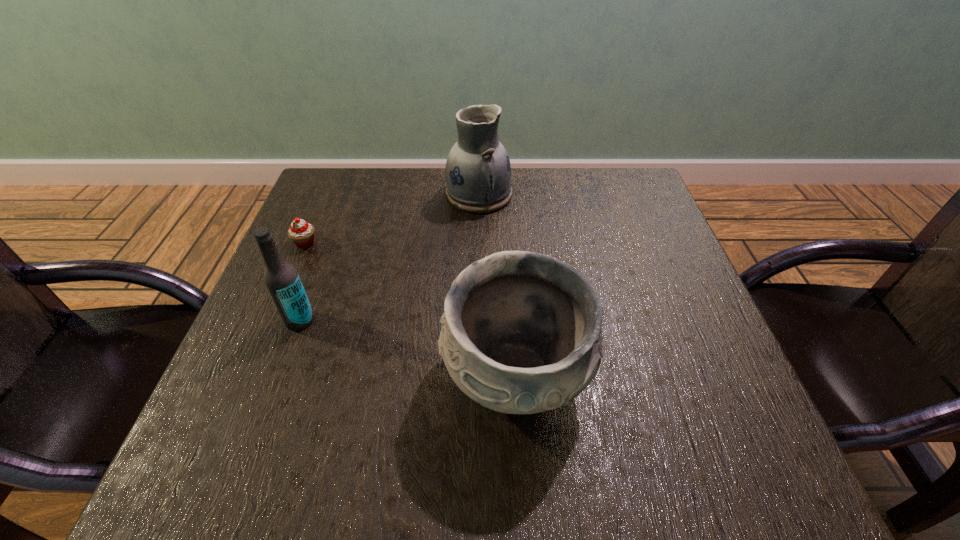
You are a GUI agent. You are given a task and a screenshot of the screen. Output one action in this format:
    pyautogui.click(x=<x>, y=<y>)
    Task: Click on the farthest object
    This screenshot has height=540, width=960.
    Given the screenshot: What is the action you would take?
    pyautogui.click(x=478, y=173)

The image size is (960, 540). What are the coordinates of `the taller pottery` in the screenshot? It's located at (478, 173).

Find the location of `beer bottle`. beer bottle is located at coordinates (282, 280).

Find the location of a particular element. the third tallest object is located at coordinates (521, 333).

Image resolution: width=960 pixels, height=540 pixels. I want to click on the nearer pottery, so click(521, 333).

The height and width of the screenshot is (540, 960). I want to click on the third nearest object, so click(302, 233).

Identify the location of the shortest object. Image resolution: width=960 pixels, height=540 pixels. (302, 233).

Where is `free space located on the front of the taller pottery`? free space located on the front of the taller pottery is located at coordinates (479, 254).

At what (x,y) coordinates should I click in order to perform the action: click on vacant area situated 0.150m on the side of the beer bottle with the label. Please return your answer as a coordinate pair (x, y). The width and height of the screenshot is (960, 540). Looking at the image, I should click on (270, 402).

Locate an element on the screen. blank area located on the back of the nearer pottery is located at coordinates (506, 227).